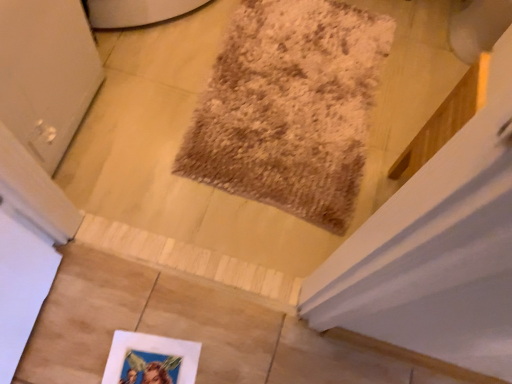
Question: Could you tell me if white matte picture frame at lower center is facing brown shaggy mat at center?

Choices:
 (A) no
 (B) yes

Answer: (B)

Question: Is white matte picture frame at lower center taller than brown shaggy mat at center?

Choices:
 (A) no
 (B) yes

Answer: (A)

Question: Is white matte picture frame at lower center positioned far away from brown shaggy mat at center?

Choices:
 (A) yes
 (B) no

Answer: (B)

Question: From the image's perspective, is white matte picture frame at lower center above brown shaggy mat at center?

Choices:
 (A) yes
 (B) no

Answer: (B)

Question: Does white matte picture frame at lower center come behind brown shaggy mat at center?

Choices:
 (A) no
 (B) yes

Answer: (A)

Question: From a real-world perspective, does white matte picture frame at lower center sit lower than brown shaggy mat at center?

Choices:
 (A) no
 (B) yes

Answer: (B)

Question: From the image's perspective, is brown shaggy mat at center on white matte picture frame at lower center?

Choices:
 (A) yes
 (B) no

Answer: (A)

Question: Considering the relative positions of brown shaggy mat at center and white matte picture frame at lower center in the image provided, is brown shaggy mat at center to the right of white matte picture frame at lower center from the viewer's perspective?

Choices:
 (A) no
 (B) yes

Answer: (B)

Question: Does brown shaggy mat at center lie behind white matte picture frame at lower center?

Choices:
 (A) yes
 (B) no

Answer: (A)

Question: Considering the relative sizes of brown shaggy mat at center and white matte picture frame at lower center in the image provided, is brown shaggy mat at center wider than white matte picture frame at lower center?

Choices:
 (A) yes
 (B) no

Answer: (A)

Question: Is brown shaggy mat at center looking in the opposite direction of white matte picture frame at lower center?

Choices:
 (A) yes
 (B) no

Answer: (B)

Question: Could you tell me if brown shaggy mat at center is turned towards white matte picture frame at lower center?

Choices:
 (A) yes
 (B) no

Answer: (A)

Question: Is white matte picture frame at lower center bigger or smaller than brown shaggy mat at center?

Choices:
 (A) big
 (B) small

Answer: (B)